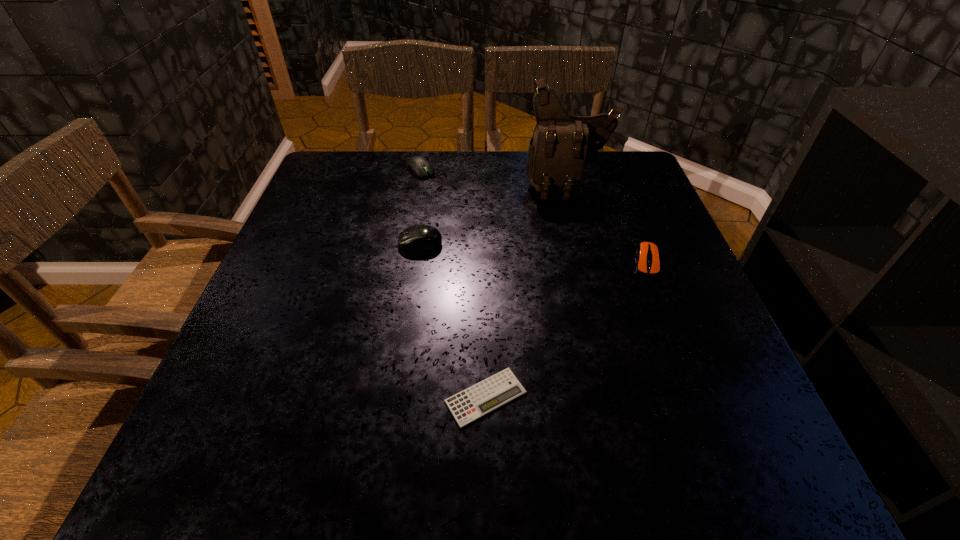
I want to click on free space located 0.330m on the front of the farthest computer mouse, so click(x=404, y=262).

At what (x,y) coordinates should I click in order to perform the action: click on blank space located on the back of the rightmost computer mouse. Please return your answer as a coordinate pair (x, y). Looking at the image, I should click on (618, 190).

Locate an element on the screen. free space located 0.320m on the right of the third object from left to right is located at coordinates [719, 397].

Locate an element on the screen. shoulder bag present at the far edge is located at coordinates coord(561,144).

This screenshot has width=960, height=540. What are the coordinates of `computer equipment that is at the far edge` in the screenshot? It's located at (419, 166).

The height and width of the screenshot is (540, 960). I want to click on shoulder bag that is at the right edge, so click(561, 144).

Identify the location of computer mouse that is at the right edge. (647, 254).

Identify the location of object that is at the far right corner. (561, 144).

At what (x,y) coordinates should I click in order to perform the action: click on vacant area at the far edge. Please return your answer as a coordinate pair (x, y). The image size is (960, 540). Looking at the image, I should click on (391, 177).

This screenshot has width=960, height=540. In order to click on vacant area at the left edge in this screenshot , I will do `click(357, 217)`.